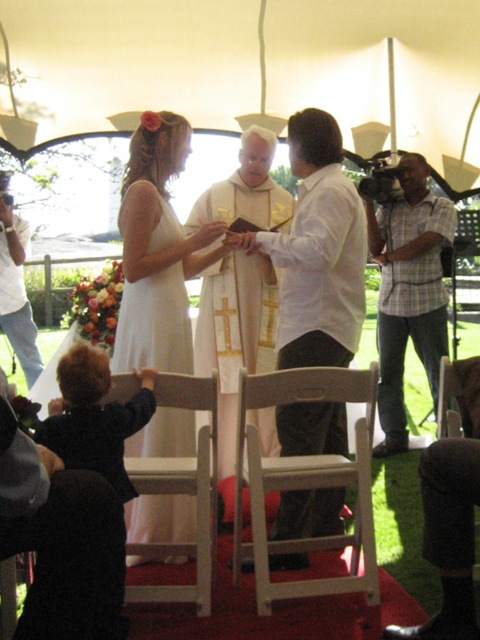
Which is more to the left, white matte shirt at center or white cotton shirt at left?

Positioned to the left is white cotton shirt at left.

Who is more forward, [328,164] or [36,333]?

Point [328,164] is more forward.

Which is in front, point (340, 497) or point (31, 380)?

Point (340, 497) is more forward.

The width and height of the screenshot is (480, 640). I want to click on white matte shirt at center, so click(x=317, y=252).

From the picture: Who is positioned more to the right, white matte shirt at center or dark blue fabric at lower left?

white matte shirt at center

Which is behind, point (290, 273) or point (96, 412)?

Positioned behind is point (290, 273).

Is point (317, 428) positioned before point (120, 438)?

No, (317, 428) is behind (120, 438).

Locate an element on the screen. The height and width of the screenshot is (640, 480). white matte shirt at center is located at coordinates (317, 252).

Is the position of white matte shirt at center less distant than that of white wood chair at lower center?

No.

Does white matte shirt at center have a lesser height compared to white wood chair at lower center?

No, white matte shirt at center is not shorter than white wood chair at lower center.

At what (x,y) coordinates should I click in order to perform the action: click on white matte shirt at center. Please return your answer as a coordinate pair (x, y). Looking at the image, I should click on (317, 252).